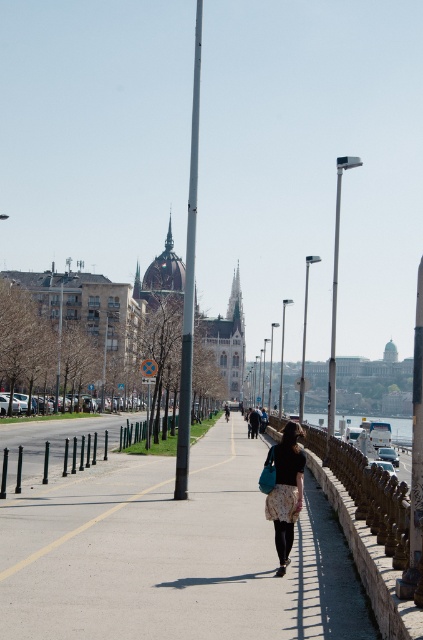
Does concrete sidewalk at center have a lesser height compared to floral skirt at center?

Incorrect, concrete sidewalk at center's height does not fall short of floral skirt at center's.

Does concrete sidewalk at center have a smaller size compared to floral skirt at center?

No.

Which is in front, point (198, 472) or point (288, 490)?

Point (288, 490)

At what (x,y) coordinates should I click in order to perform the action: click on concrete sidewalk at center. Please return your answer as a coordinate pair (x, y). The height and width of the screenshot is (640, 423). Looking at the image, I should click on (175, 556).